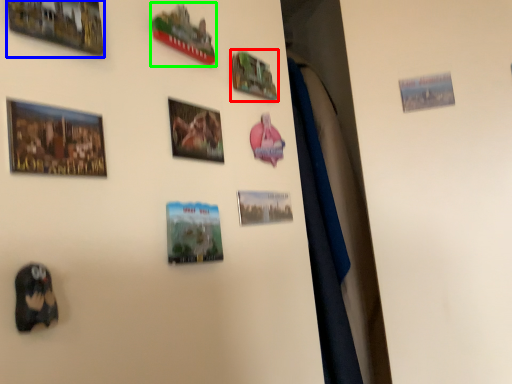
Question: Which object is positioned farthest from picture frame (highlighted by a red box)? Select from picture frame (highlighted by a blue box) and picture frame (highlighted by a green box).

Choices:
 (A) picture frame
 (B) picture frame

Answer: (A)